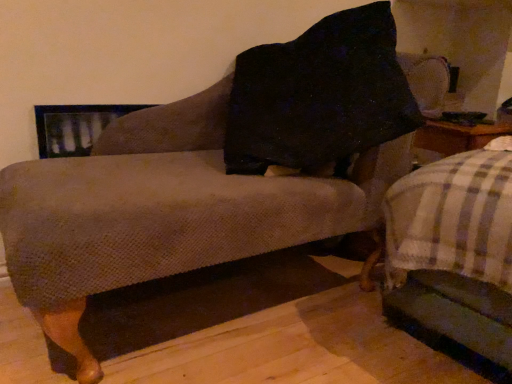
Question: Should I look upward or downward to see plaid fabric bed frame at lower right?

Choices:
 (A) down
 (B) up

Answer: (A)